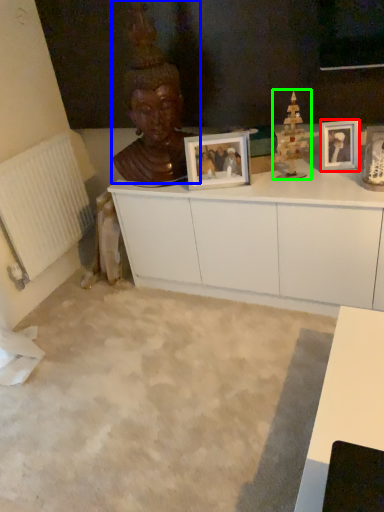
Question: Which object is the farthest from picture frame (highlighted by a red box)? Choose among these: person (highlighted by a blue box) or toy (highlighted by a green box).

Choices:
 (A) person
 (B) toy

Answer: (A)